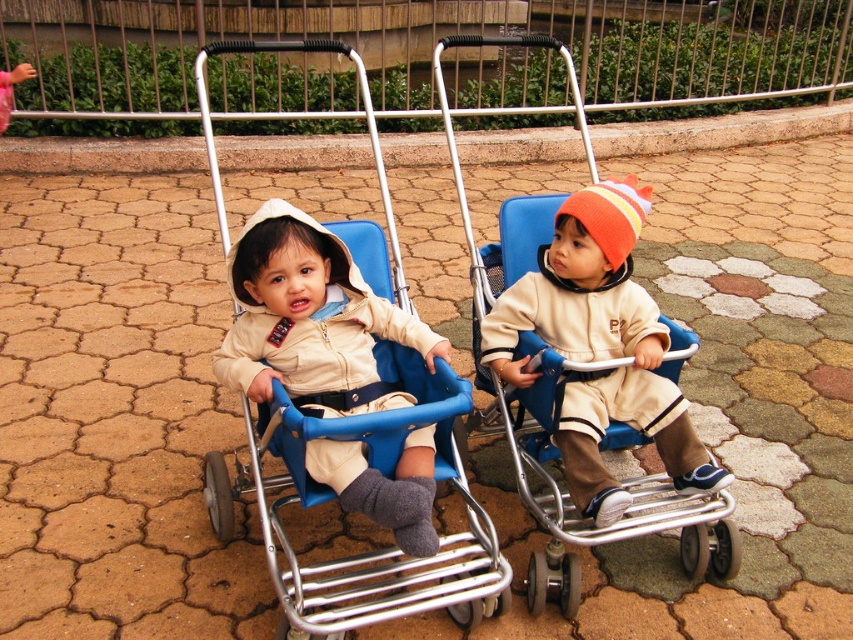
You are a photographer trying to capture both the metallic blue baby carriage at center and the matte beige sweater at center in a single shot. Since you want both to be in focus, which object should you adjust your camera focus on first?

The metallic blue baby carriage at center is closer to the viewer than the matte beige sweater at center. To ensure both are in focus, you should focus on the farther object first, which is the matte beige sweater at center.

You are a parent standing next to the metallic blue baby carriage at center. You want to place a small bag on the ground between you and the carriage. Is there enough space for the bag?

The metallic blue baby carriage at center and viewer are 5.65 feet apart, so there is sufficient space to place a small bag on the ground between you and the carriage.

You are a photographer trying to capture both the beige soft fabric jacket at center and the matte beige sweater at center in a single frame. Based on their positions, which one is positioned to the left?

The beige soft fabric jacket at center is to the left of the matte beige sweater at center, so the beige soft fabric jacket at center is positioned to the left.